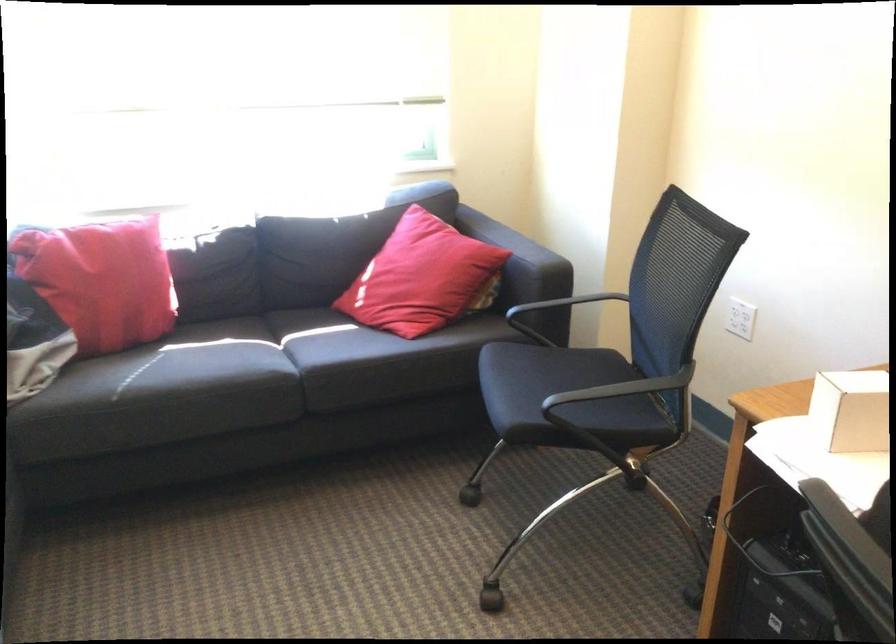
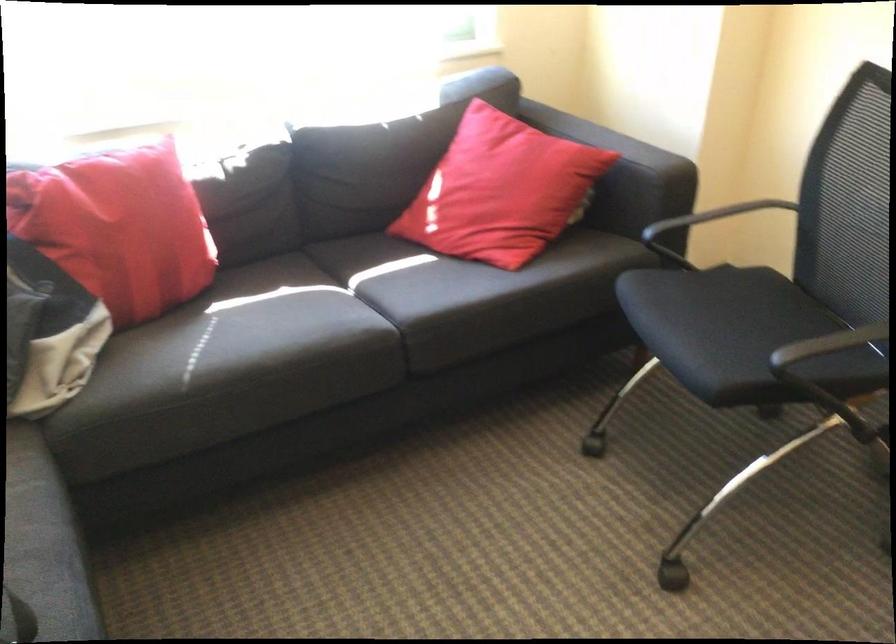
The point at [92,279] is marked in the first image. Where is the corresponding point in the second image?

(117, 228)